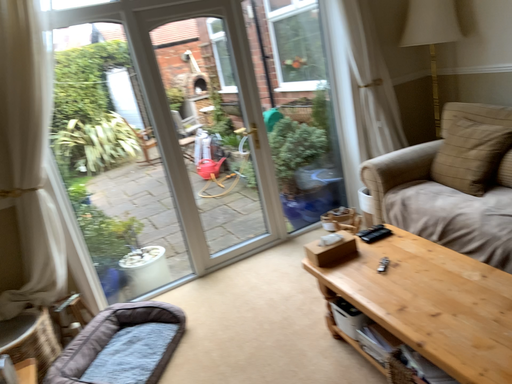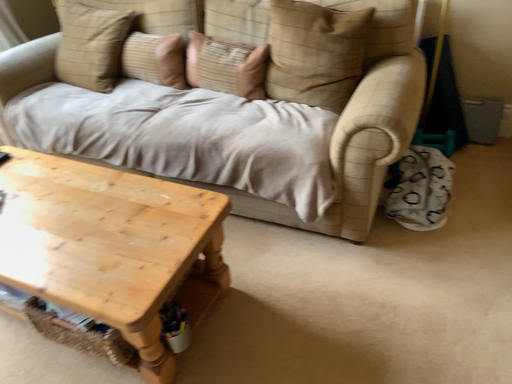
Question: Which way did the camera rotate in the video?

Choices:
 (A) rotated right
 (B) rotated left

Answer: (A)